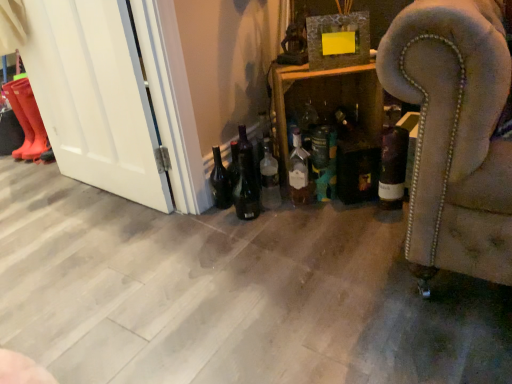
Where is `vacant space positioned to the left of green matte bottle at center, arranged as the third bottle when viewed from the left`? The height and width of the screenshot is (384, 512). vacant space positioned to the left of green matte bottle at center, arranged as the third bottle when viewed from the left is located at coordinates (291, 210).